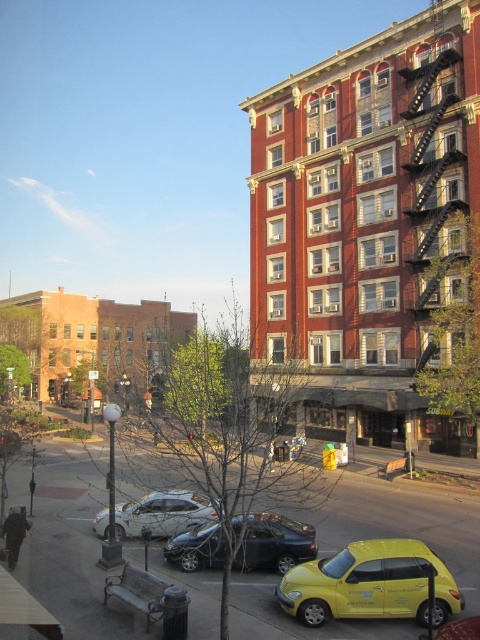
You are a delivery driver who needs to park your 3.5 meter long truck between the yellow matte hatchback at lower right and the silver metallic sedan at center. Is there enough space to park your truck without overlapping either vehicle?

The distance between the yellow matte hatchback at lower right and the silver metallic sedan at center is 6.38 meters. Since your truck is 3.5 meters long, there is sufficient space to park without overlapping either vehicle as 6.38 meters is greater than 3.5 meters.

You are standing on the street looking at the tall red brick building. There are two points marked on the building wall, one at coordinates point (282, 516) and another at point (162, 536). Which of these points is closer to you?

Point (282, 516) is in front of point (162, 536), so it is closer to you.